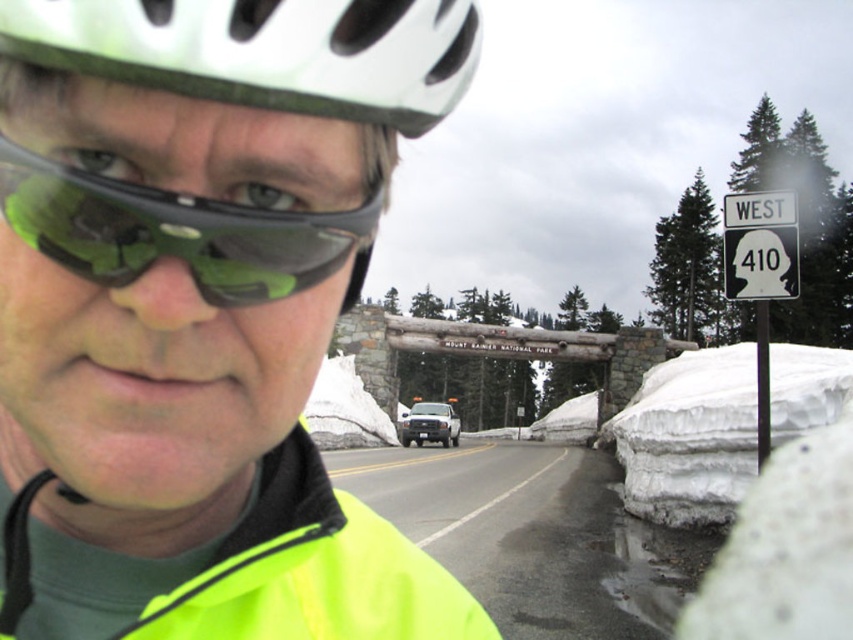
Question: Can you confirm if neon yellow jacket at center is positioned above glossy asphalt road at lower center?

Choices:
 (A) yes
 (B) no

Answer: (A)

Question: Which point is closer to the camera taking this photo?

Choices:
 (A) (184, 84)
 (B) (277, 221)
 (C) (546, 547)
 (D) (660, 461)

Answer: (A)

Question: Which point is closer to the camera?

Choices:
 (A) (268, 216)
 (B) (204, 49)
 (C) (427, 561)
 (D) (630, 490)

Answer: (B)

Question: Can you confirm if green reflective lens at center is bigger than white fluffy snow at lower right?

Choices:
 (A) yes
 (B) no

Answer: (B)

Question: Can you confirm if neon yellow jacket at center is positioned below white matte bicycle helmet at upper center?

Choices:
 (A) yes
 (B) no

Answer: (A)

Question: Which object is farther from the camera taking this photo?

Choices:
 (A) white matte bicycle helmet at upper center
 (B) neon yellow jacket at center
 (C) white fluffy snow at lower right

Answer: (C)